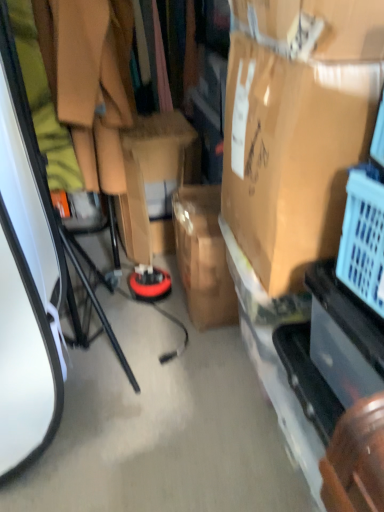
You are a GUI agent. You are given a task and a screenshot of the screen. Output one action in this format:
    pyautogui.click(x=<x>, y=<y>)
    Task: Click on the brown cardboard box at upper right
    This screenshot has height=512, width=384.
    Given the screenshot: What is the action you would take?
    pyautogui.click(x=296, y=126)

What do you see at coordinates (296, 126) in the screenshot? I see `brown cardboard box at upper right` at bounding box center [296, 126].

You are a GUI agent. You are given a task and a screenshot of the screen. Output one action in this format:
    pyautogui.click(x=<x>, y=<y>)
    Task: Click on the brown cardboard box at upper right
    The height and width of the screenshot is (512, 384).
    Given the screenshot: What is the action you would take?
    pyautogui.click(x=296, y=126)